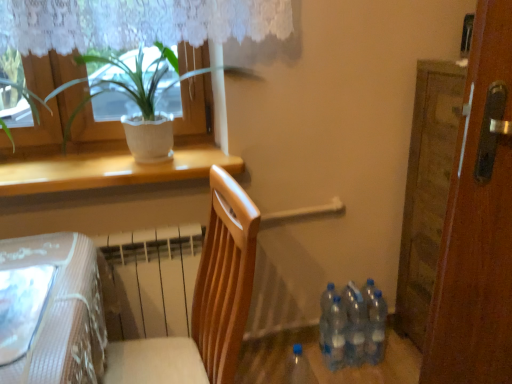
Question: Does point (206, 342) appear closer or farther from the camera than point (180, 120)?

Choices:
 (A) closer
 (B) farther

Answer: (A)

Question: Looking at their shapes, would you say wooden chair at center is wider or thinner than green leafy plant at upper left?

Choices:
 (A) wide
 (B) thin

Answer: (A)

Question: Considering the real-world distances, which object is farthest from the white matte window sill at upper left?

Choices:
 (A) green leafy plant at upper left
 (B) transparent plastic bottles at lower right, which is counted as the fourth bottle, starting from the right
 (C) blue translucent bottle at lower center, placed as the 5th bottle when sorted from right to left
 (D) wooden door at right
 (E) translucent plastic bottles at lower right, which is the 4th bottle from left to right

Answer: (C)

Question: Which object is the closest to the transparent plastic bottles at lower right, arranged as the third bottle when viewed from the left?

Choices:
 (A) wooden door at right
 (B) transparent plastic bottles at lower right, which is counted as the fourth bottle, starting from the right
 (C) transparent plastic bottles at lower right, acting as the fifth bottle starting from the left
 (D) green leafy plant at upper left
 (E) wooden chair at center

Answer: (B)